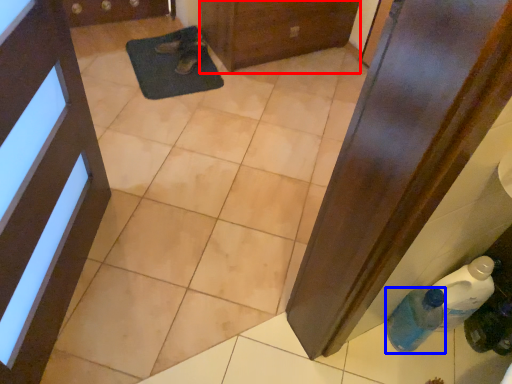
Question: Which point is further to the camera, door (highlighted by a red box) or bottle (highlighted by a blue box)?

Choices:
 (A) door
 (B) bottle

Answer: (A)